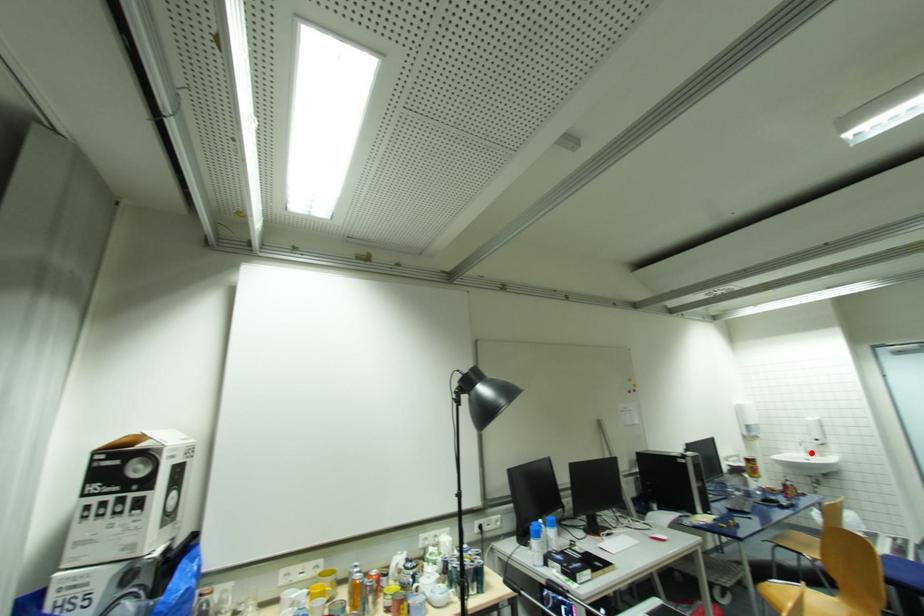
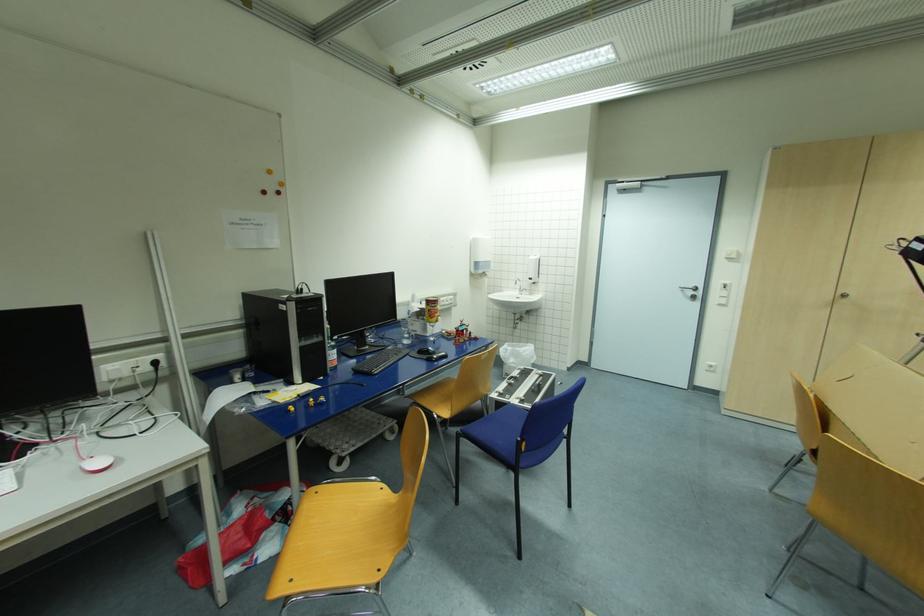
The point at the highlighted location is marked in the first image. Where is the corresponding point in the second image?

(525, 291)